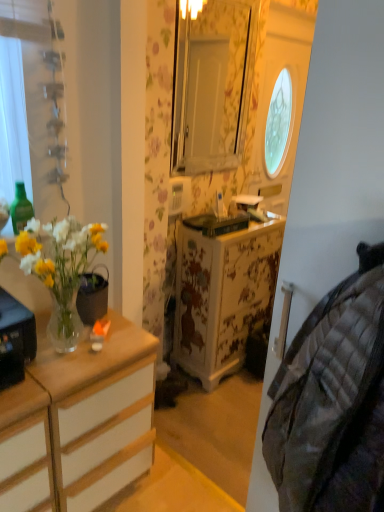
Question: Is plaid fabric quilt at right next to clear glass vase at left?

Choices:
 (A) yes
 (B) no

Answer: (B)

Question: Is plaid fabric quilt at right taller than clear glass vase at left?

Choices:
 (A) no
 (B) yes

Answer: (B)

Question: Can you confirm if plaid fabric quilt at right is smaller than clear glass vase at left?

Choices:
 (A) no
 (B) yes

Answer: (A)

Question: From the image's perspective, is plaid fabric quilt at right under clear glass vase at left?

Choices:
 (A) no
 (B) yes

Answer: (B)

Question: Can you confirm if plaid fabric quilt at right is bigger than clear glass vase at left?

Choices:
 (A) yes
 (B) no

Answer: (A)

Question: Is green glass bottle at left in front of or behind clear glass vase at left in the image?

Choices:
 (A) front
 (B) behind

Answer: (B)

Question: Considering the positions of point (21, 192) and point (3, 307), is point (21, 192) closer or farther from the camera than point (3, 307)?

Choices:
 (A) farther
 (B) closer

Answer: (A)

Question: In the image, is green glass bottle at left on the left side or the right side of clear glass vase at left?

Choices:
 (A) right
 (B) left

Answer: (A)

Question: From a real-world perspective, is green glass bottle at left positioned above or below clear glass vase at left?

Choices:
 (A) above
 (B) below

Answer: (A)

Question: Is clear glass vase at left wider or thinner than green glass bottle at left?

Choices:
 (A) thin
 (B) wide

Answer: (B)

Question: Considering the positions of point (13, 379) and point (16, 215), is point (13, 379) closer or farther from the camera than point (16, 215)?

Choices:
 (A) farther
 (B) closer

Answer: (B)

Question: From a real-world perspective, is clear glass vase at left above or below green glass bottle at left?

Choices:
 (A) below
 (B) above

Answer: (A)

Question: From the image's perspective, relative to green glass bottle at left, is clear glass vase at left above or below?

Choices:
 (A) above
 (B) below

Answer: (B)

Question: In the image, is clear glass vase at left positioned in front of or behind plaid fabric quilt at right?

Choices:
 (A) front
 (B) behind

Answer: (B)

Question: From a real-world perspective, is clear glass vase at left physically located above or below plaid fabric quilt at right?

Choices:
 (A) below
 (B) above

Answer: (A)